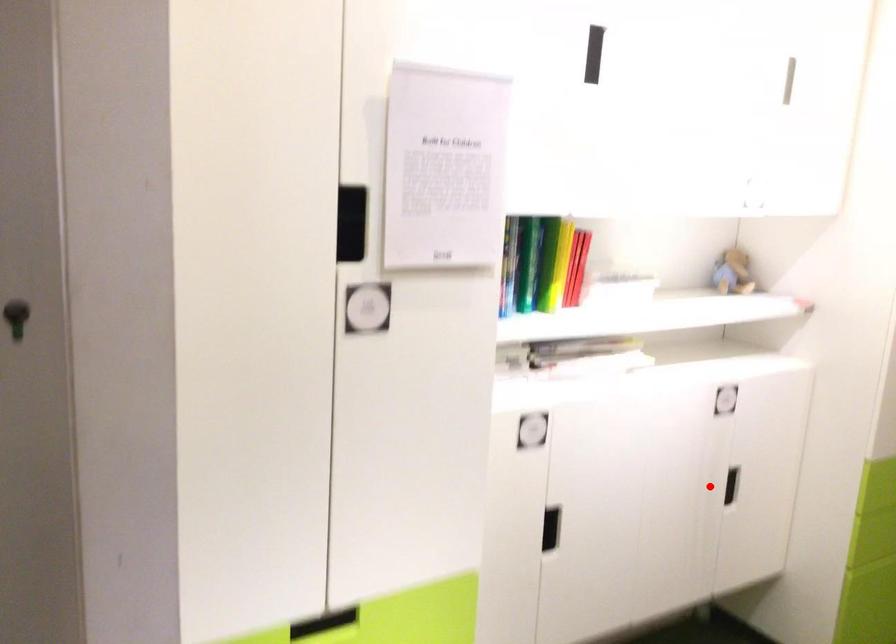
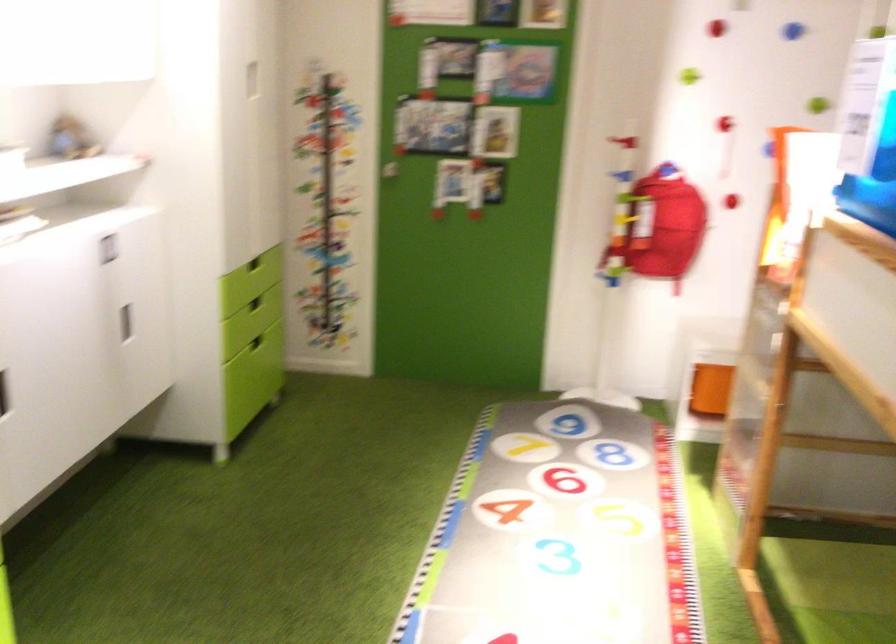
Find the pixel in the second image that matches the highlighted location in the first image.

(125, 323)